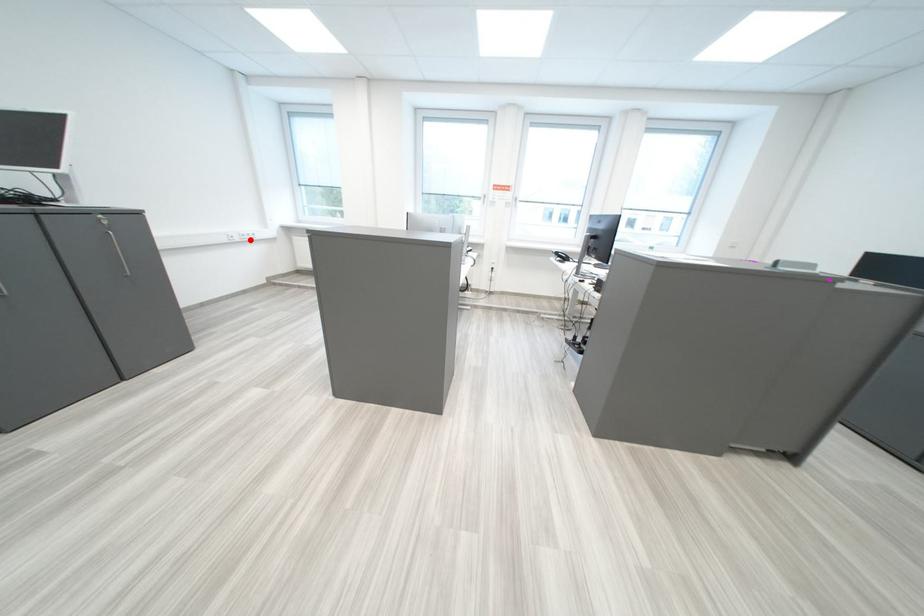
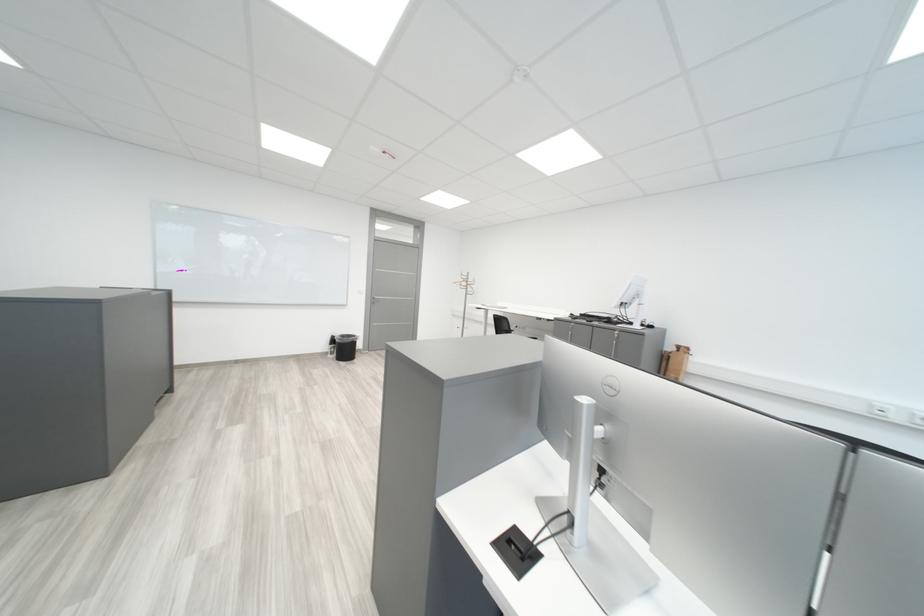
Question: I am providing you with two images of the same scene from different viewpoints. A red point is shown in image1. For the corresponding object point in image2, is it positioned nearer or farther from the camera?

Choices:
 (A) Nearer
 (B) Farther

Answer: (B)